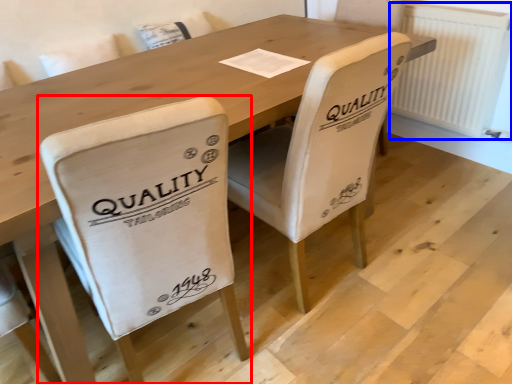
Question: Which point is further to the camera, chair (highlighted by a red box) or radiator (highlighted by a blue box)?

Choices:
 (A) chair
 (B) radiator

Answer: (B)